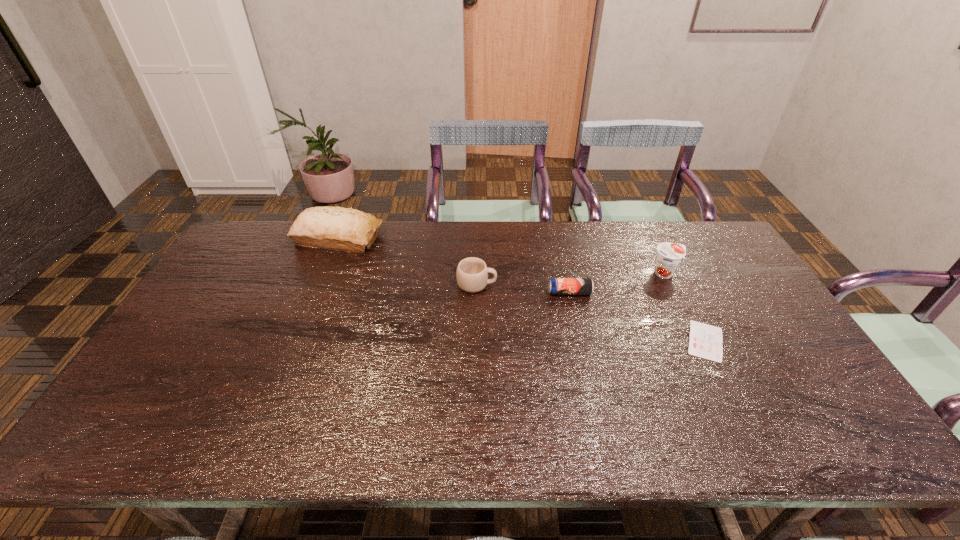
Find the location of a particular element. vacant space located 0.280m on the left of the yogurt is located at coordinates point(564,273).

You are a GUI agent. You are given a task and a screenshot of the screen. Output one action in this format:
    pyautogui.click(x=<x>, y=<y>)
    Task: Click on the vacant space located on the side of the second object from left to right with the handle
    
    Given the screenshot: What is the action you would take?
    pyautogui.click(x=567, y=285)

Image resolution: width=960 pixels, height=540 pixels. What are the coordinates of `vacant area situated 0.070m on the left of the fourth tallest object` in the screenshot? It's located at (526, 293).

Find the location of a particular element. vacant region located 0.320m on the left of the diary is located at coordinates (565, 341).

Locate an element on the screen. The image size is (960, 540). object that is at the far edge is located at coordinates (335, 228).

Identify the location of vacant region at the far edge of the desktop. The height and width of the screenshot is (540, 960). (425, 262).

I want to click on vacant space at the near edge of the desktop, so click(255, 440).

Image resolution: width=960 pixels, height=540 pixels. Find the location of `blank space at the left edge`. blank space at the left edge is located at coordinates (184, 369).

This screenshot has height=540, width=960. What are the coordinates of `vacant region at the far left corner of the desktop` in the screenshot? It's located at (245, 258).

In the image, there is a desktop. Identify the location of vacant region at the far right corner. Image resolution: width=960 pixels, height=540 pixels. (672, 225).